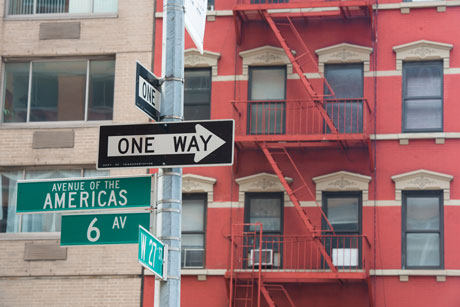
You are a GUI agent. You are given a task and a screenshot of the screen. Output one action in this format:
    pyautogui.click(x=<x>, y=<y>)
    Task: Click on the stairs
    The image size is (460, 307).
    Given the screenshot: What is the action you would take?
    pyautogui.click(x=295, y=150)